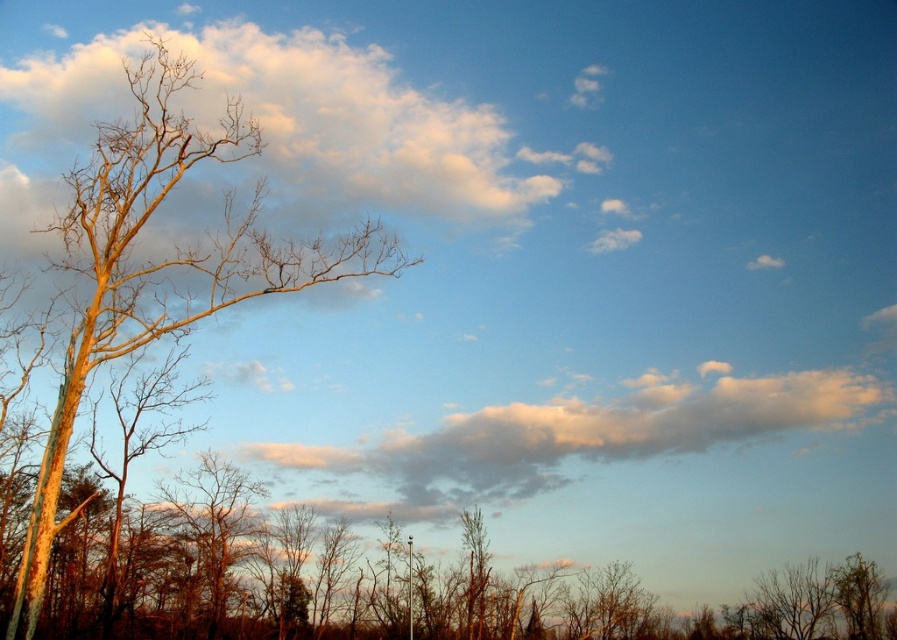
You are an artist sketching the scene. You need to draw the smooth brown tree at left and the white fluffy cloud at upper center. Based on their positions, which object should you draw first to maintain proper perspective?

The smooth brown tree at left should be drawn first because it is located above the white fluffy cloud at upper center, meaning it is closer to the viewer and should be placed in the foreground to maintain perspective.